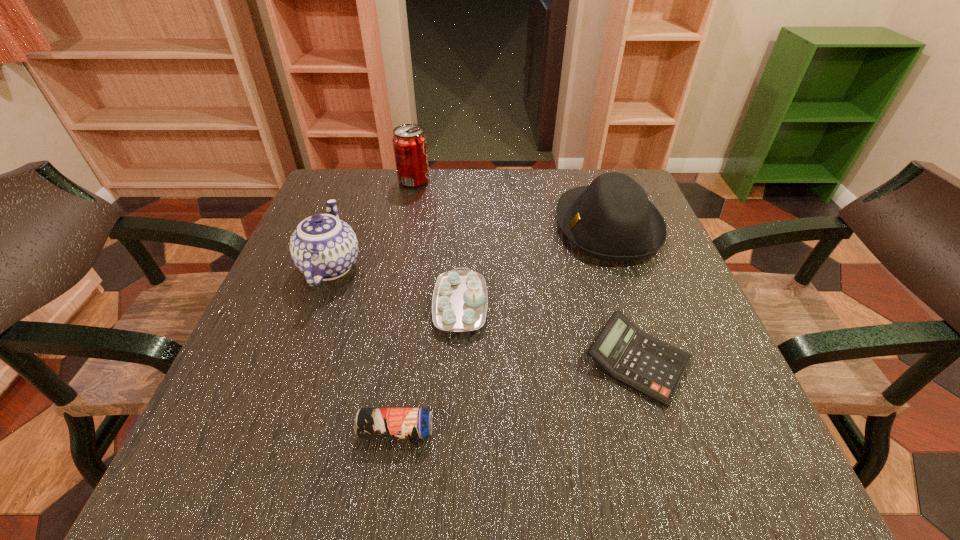
Locate an element on the screen. This screenshot has width=960, height=540. object that is the fifth closest to the beer can is located at coordinates (409, 141).

You are a GUI agent. You are given a task and a screenshot of the screen. Output one action in this format:
    pyautogui.click(x=<x>, y=<y>)
    Task: Click on the free spot that satisfies the following two spatial constraints: 1. on the front-facing side of the fedora; 2. on the front side of the shorter chinaware
    
    Given the screenshot: What is the action you would take?
    pyautogui.click(x=636, y=305)

Locate an element on the screen. The height and width of the screenshot is (540, 960). vacant region that satisfies the following two spatial constraints: 1. at the spout of the pop soda; 2. on the left side of the left chinaware is located at coordinates (363, 180).